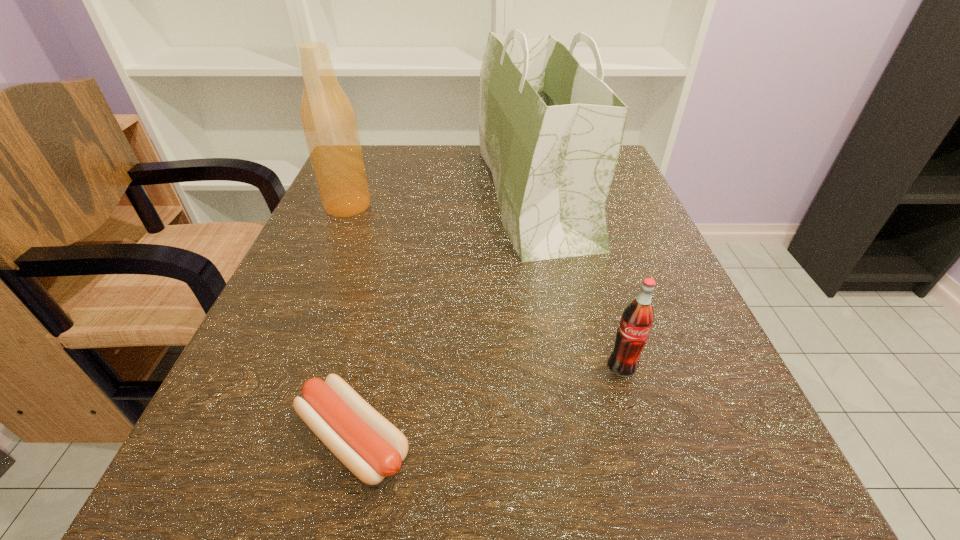
This screenshot has width=960, height=540. I want to click on grocery bag situated at the far edge, so click(550, 131).

Where is `beer bottle located at the far edge`? Image resolution: width=960 pixels, height=540 pixels. beer bottle located at the far edge is located at coordinates (328, 119).

Locate an element on the screen. The height and width of the screenshot is (540, 960). object situated at the near edge is located at coordinates (371, 447).

The width and height of the screenshot is (960, 540). Identify the location of beer bottle at the left edge. (328, 119).

This screenshot has width=960, height=540. I want to click on sausage that is at the left edge, so click(371, 447).

What are the coordinates of `grocery bag that is at the right edge` in the screenshot? It's located at (550, 131).

You are a GUI agent. You are given a task and a screenshot of the screen. Output one action in this format:
    pyautogui.click(x=<x>, y=<y>)
    Task: Click on the soda bottle positioned at the right edge
    The height and width of the screenshot is (540, 960).
    Given the screenshot: What is the action you would take?
    pyautogui.click(x=637, y=319)

Find the location of `object positioned at the far left corner`. object positioned at the far left corner is located at coordinates point(328,119).

This screenshot has width=960, height=540. Identify the location of object that is at the near left corner. (371, 447).

Identify the location of object situated at the far right corner. The image size is (960, 540). (550, 131).